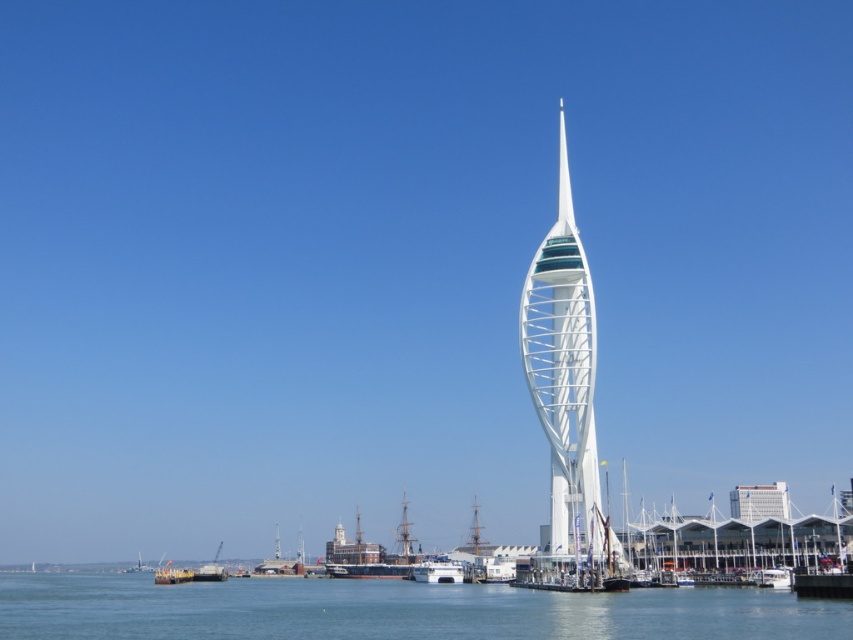
Is clear blue water at lower center to the right of white glass tower at center from the viewer's perspective?

Incorrect, clear blue water at lower center is not on the right side of white glass tower at center.

Find the location of a particular element. clear blue water at lower center is located at coordinates (395, 611).

Between white glossy spire at center and white wooden boat at lower left, which one appears on the left side from the viewer's perspective?

white wooden boat at lower left is more to the left.

I want to click on white glossy spire at center, so click(x=404, y=540).

Which is in front, point (404, 548) or point (154, 570)?

Positioned in front is point (404, 548).

At what (x,y) coordinates should I click in order to perform the action: click on white glossy spire at center. Please return your answer as a coordinate pair (x, y). The image size is (853, 640). Looking at the image, I should click on (404, 540).

Who is more forward, (820, 577) or (170, 566)?

Point (820, 577) is more forward.

From the picture: Is black wood dock at lower right above white glossy boat at lower left?

Yes, black wood dock at lower right is above white glossy boat at lower left.

Is point (840, 576) farther from camera compared to point (158, 580)?

No.

Locate an element on the screen. The height and width of the screenshot is (640, 853). black wood dock at lower right is located at coordinates (822, 584).